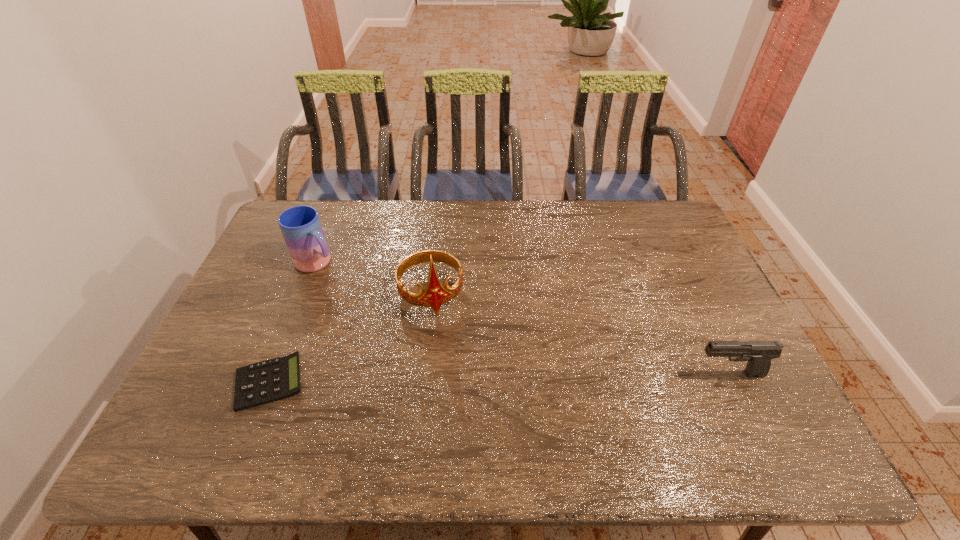
The width and height of the screenshot is (960, 540). I want to click on free space between the third shortest object and the pistol, so click(x=523, y=319).

Where is `empty space between the second object from right to left and the calculator`? This screenshot has height=540, width=960. empty space between the second object from right to left and the calculator is located at coordinates (350, 338).

I want to click on unoccupied position between the tallest object and the shortest object, so click(350, 338).

Find the location of a particular element. This screenshot has width=960, height=540. free area in between the third shortest object and the tiara is located at coordinates (374, 278).

The width and height of the screenshot is (960, 540). Find the location of `vacant area that lies between the mug and the shortest object`. vacant area that lies between the mug and the shortest object is located at coordinates (293, 323).

Point out which object is positioned as the second nearest to the third shortest object. Please provide its 2D coordinates. Your answer should be formatted as a tuple, i.e. [(x, y)], where the tuple contains the x and y coordinates of a point satisfying the conditions above.

[(272, 380)]

Identify the location of object identified as the closest to the second tallest object. (435, 294).

Where is `vacant position in the image that satisfies the following two spatial constraints: 1. on the back side of the rightmost object; 2. aim along the barrel of the shortest object`? This screenshot has width=960, height=540. vacant position in the image that satisfies the following two spatial constraints: 1. on the back side of the rightmost object; 2. aim along the barrel of the shortest object is located at coordinates (273, 374).

You are a GUI agent. You are given a task and a screenshot of the screen. Output one action in this format:
    pyautogui.click(x=<x>, y=<y>)
    Task: Click on the vacant space that satisfies the following two spatial constraints: 1. on the back side of the second object from right to left; 2. on the right side of the shortest object
    This screenshot has width=960, height=540.
    Given the screenshot: What is the action you would take?
    pyautogui.click(x=304, y=294)

Identify the location of free location that satisfies the following two spatial constraints: 1. on the back side of the shortest object; 2. aim along the barrel of the pistol. The image size is (960, 540). (273, 374).